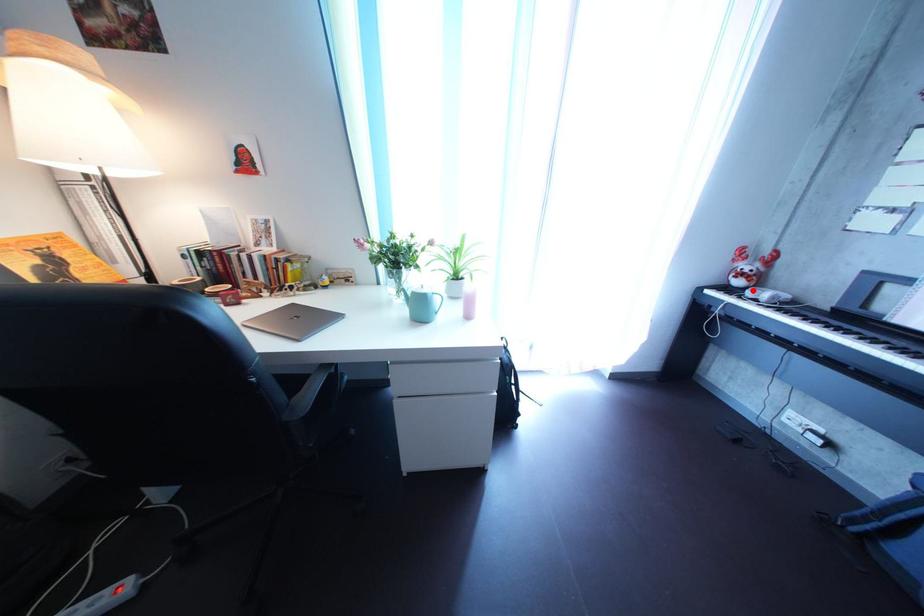
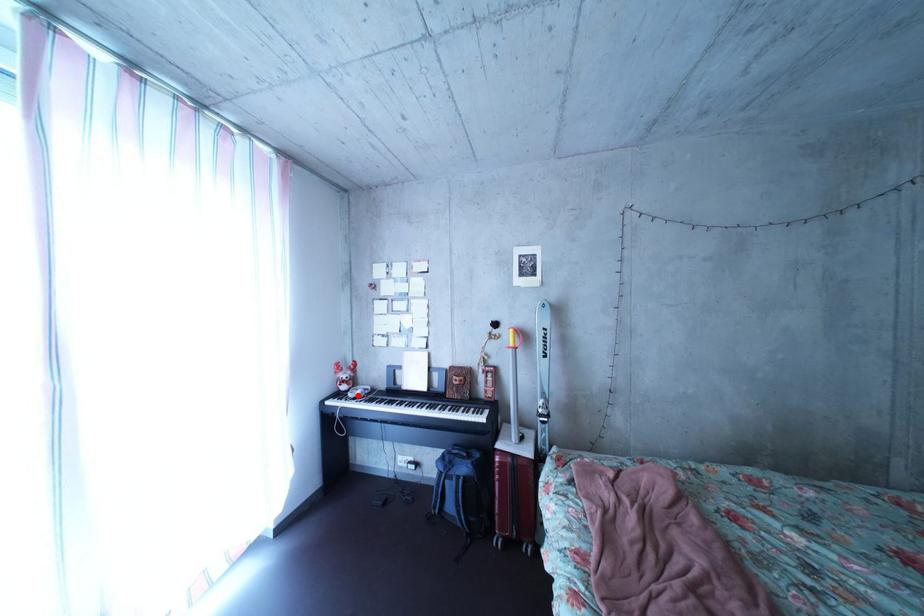
I am providing you with two images of the same scene from different viewpoints. A red point is marked on the first image and another point is marked on the second image. Are the points marked in image1 and image2 representing the same 3D position?

Yes